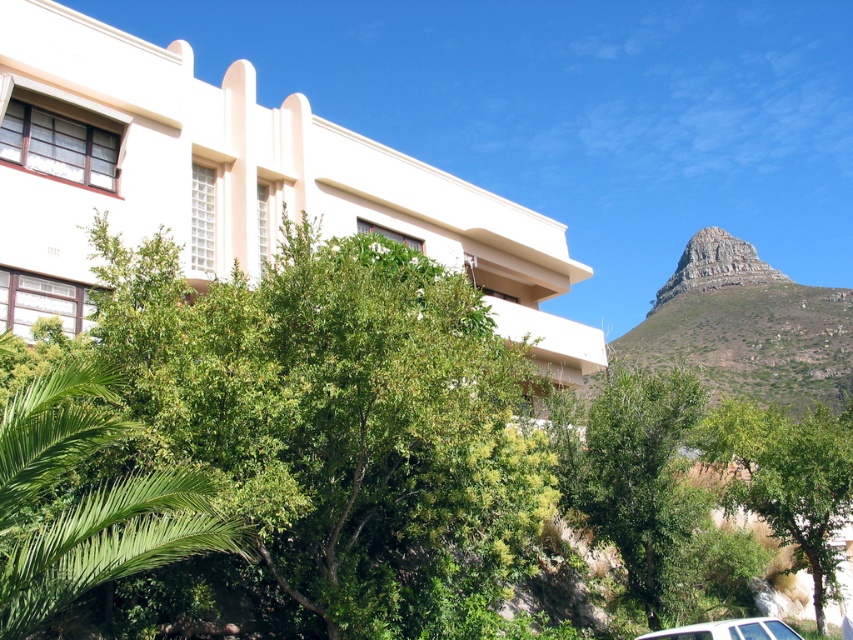
Based on the coordinates provided, where is the green grassy mountain at upper right located in the image?

The green grassy mountain at upper right is located at the 2D coordinates point (746,326) in the image.

You are standing in front of the modern building and see the green leafy palm at lower left and the white matte car at lower right. Which object is closer to you?

The green leafy palm at lower left is closer to you because it is positioned over the white matte car at lower right, indicating it is in front.